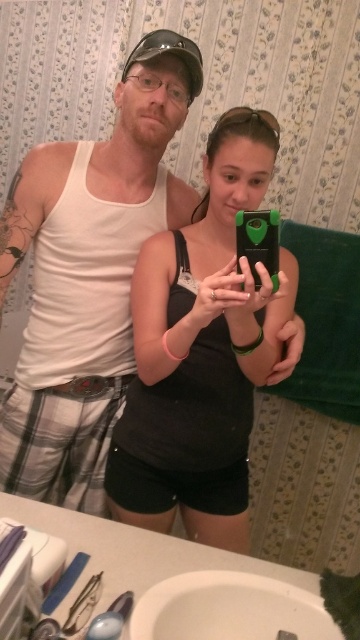
Question: Does white matte tank top at upper left have a smaller size compared to matte black tank top at center?

Choices:
 (A) no
 (B) yes

Answer: (B)

Question: Which point is closer to the camera?

Choices:
 (A) (297, 586)
 (B) (294, 280)

Answer: (A)

Question: In this image, where is matte black tank top at center located relative to white ceramic sink at lower center?

Choices:
 (A) below
 (B) above

Answer: (B)

Question: Which object is positioned farthest from the white ceramic sink at lower center?

Choices:
 (A) matte black tank top at center
 (B) white matte tank top at upper left

Answer: (B)

Question: Is white matte tank top at upper left closer to the viewer compared to white ceramic sink at lower center?

Choices:
 (A) yes
 (B) no

Answer: (B)

Question: Which point is closer to the camera?

Choices:
 (A) white matte tank top at upper left
 (B) white ceramic sink at lower center

Answer: (B)